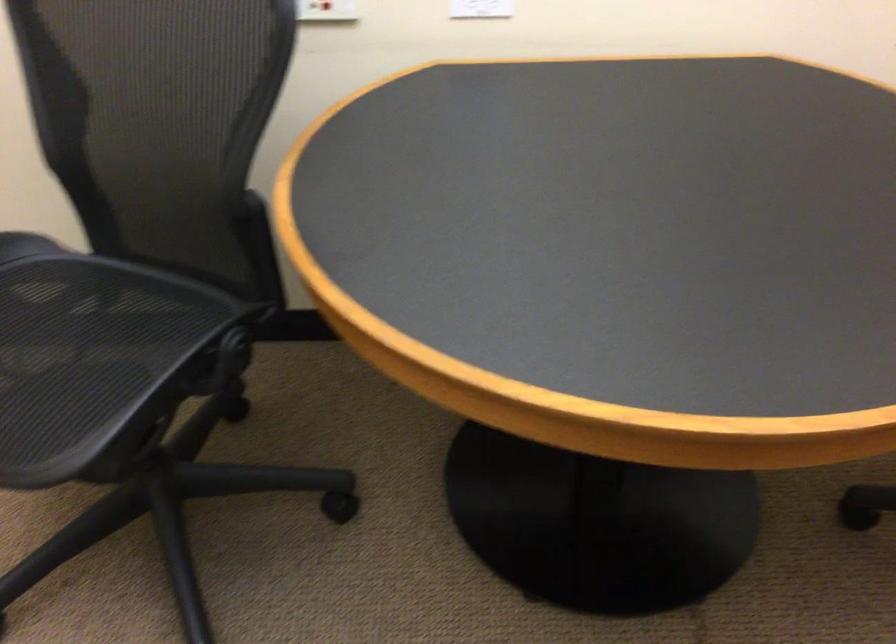
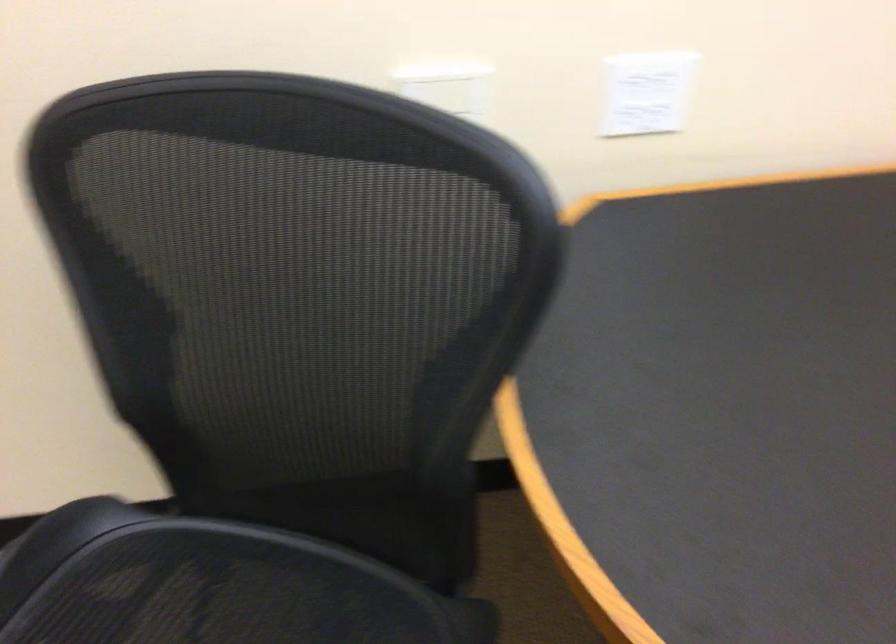
Question: The camera is either moving clockwise (left) or counter-clockwise (right) around the object. The first image is from the beginning of the video and the second image is from the end. Is the camera moving left or right when shooting the video?

Choices:
 (A) Left
 (B) Right

Answer: (A)